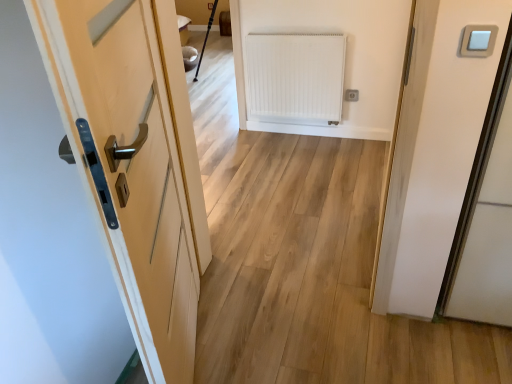
Where is `vacant space behind matte wood door at left`? This screenshot has height=384, width=512. vacant space behind matte wood door at left is located at coordinates (242, 277).